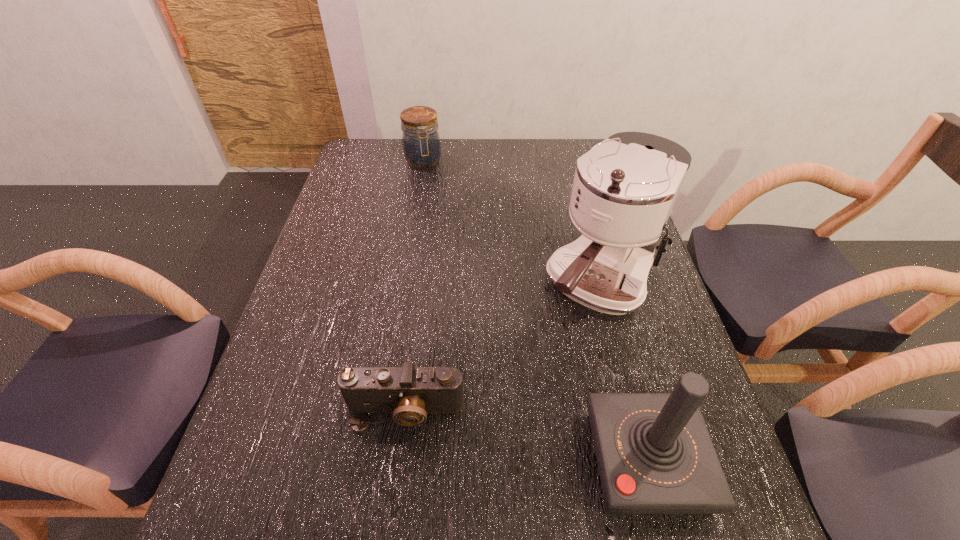
In the image, there is a desktop. Where is `vacant space at the right edge`? This screenshot has width=960, height=540. vacant space at the right edge is located at coordinates 679,350.

The image size is (960, 540). What are the coordinates of `vacant space at the far left corner` in the screenshot? It's located at (387, 148).

The width and height of the screenshot is (960, 540). I want to click on vacant space that's between the shortest object and the coffee maker, so tap(502, 348).

Where is `empty space between the shortest object and the second farthest object`? Image resolution: width=960 pixels, height=540 pixels. empty space between the shortest object and the second farthest object is located at coordinates (502, 348).

Find the location of a particular element. vacant space that is in between the second farthest object and the third shortest object is located at coordinates click(x=622, y=373).

Where is `free space between the joystick and the coffee maker`? Image resolution: width=960 pixels, height=540 pixels. free space between the joystick and the coffee maker is located at coordinates (622, 373).

At what (x,y) coordinates should I click in order to perform the action: click on empty space between the tallest object and the jar. Please return your answer as a coordinate pair (x, y). The height and width of the screenshot is (540, 960). Looking at the image, I should click on (511, 223).

Find the location of a particular element. Image resolution: width=960 pixels, height=540 pixels. free space between the camera and the third shortest object is located at coordinates (525, 436).

Where is `empty space that is in between the camera and the second farthest object`? Image resolution: width=960 pixels, height=540 pixels. empty space that is in between the camera and the second farthest object is located at coordinates (502, 348).

This screenshot has height=540, width=960. Find the location of `vacant area between the farthest object and the coffee maker`. vacant area between the farthest object and the coffee maker is located at coordinates (511, 223).